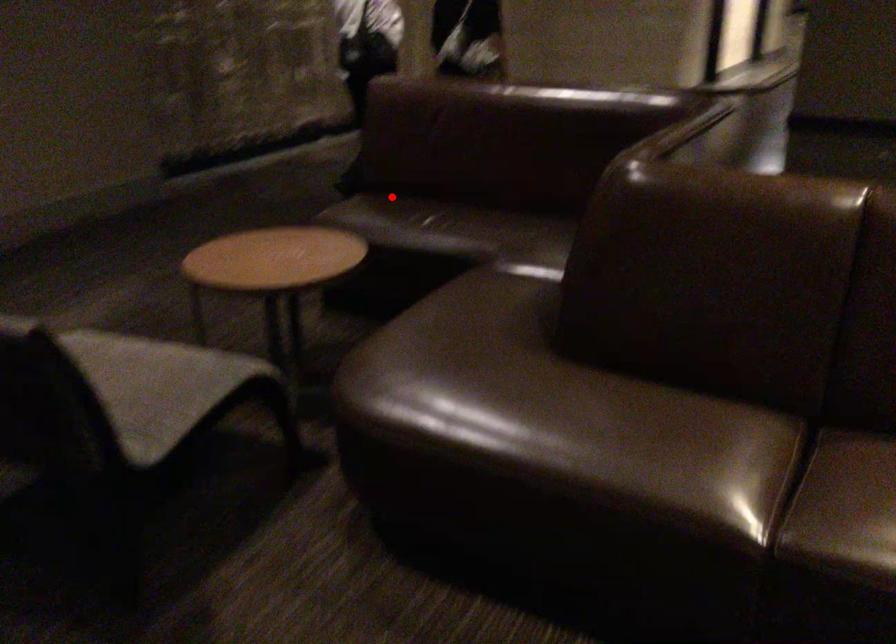
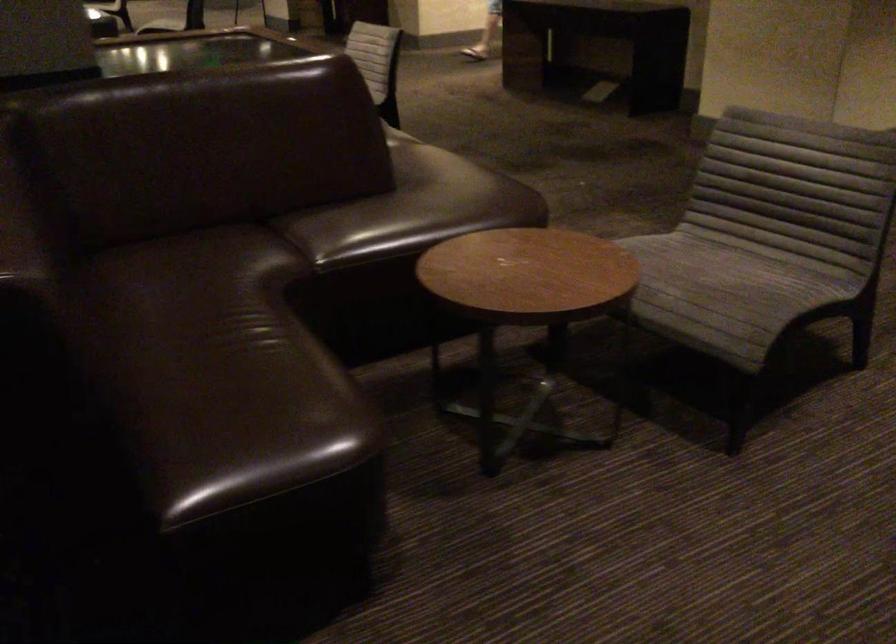
In the second image, find the point that corresponds to the highlighted location in the first image.

(231, 399)